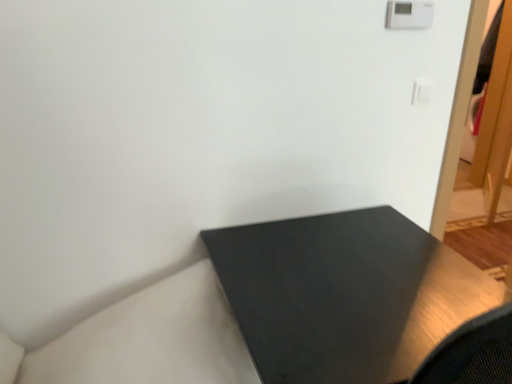
Question: Is white plastic light switch at upper right wider than matte black table at lower left?

Choices:
 (A) no
 (B) yes

Answer: (A)

Question: Does white plastic light switch at upper right come behind matte black table at lower left?

Choices:
 (A) no
 (B) yes

Answer: (B)

Question: Is white plastic light switch at upper right in front of matte black table at lower left?

Choices:
 (A) yes
 (B) no

Answer: (B)

Question: Can matte black table at lower left be found inside white plastic light switch at upper right?

Choices:
 (A) no
 (B) yes

Answer: (A)

Question: Considering the relative positions of white plastic light switch at upper right and matte black table at lower left in the image provided, is white plastic light switch at upper right to the left of matte black table at lower left from the viewer's perspective?

Choices:
 (A) yes
 (B) no

Answer: (B)

Question: Is white plastic light switch at upper right shorter than matte black table at lower left?

Choices:
 (A) yes
 (B) no

Answer: (A)

Question: From the image's perspective, is matte black table at lower left over white plastic light switch at upper right?

Choices:
 (A) no
 (B) yes

Answer: (A)

Question: Does matte black table at lower left have a greater width compared to white plastic light switch at upper right?

Choices:
 (A) no
 (B) yes

Answer: (B)

Question: Is matte black table at lower left closer to the viewer compared to white plastic light switch at upper right?

Choices:
 (A) yes
 (B) no

Answer: (A)

Question: Can you confirm if matte black table at lower left is smaller than white plastic light switch at upper right?

Choices:
 (A) yes
 (B) no

Answer: (B)

Question: From the image's perspective, is matte black table at lower left under white plastic light switch at upper right?

Choices:
 (A) no
 (B) yes

Answer: (B)

Question: Is matte black table at lower left taller than white plastic light switch at upper right?

Choices:
 (A) yes
 (B) no

Answer: (A)

Question: Considering the positions of matte black table at lower left and white plastic light switch at upper right in the image, is matte black table at lower left wider or thinner than white plastic light switch at upper right?

Choices:
 (A) wide
 (B) thin

Answer: (A)